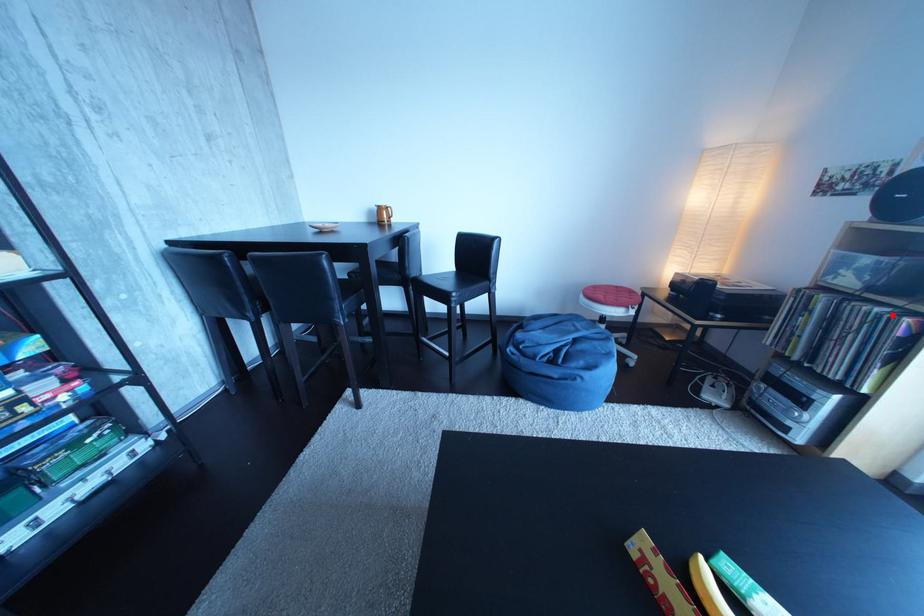
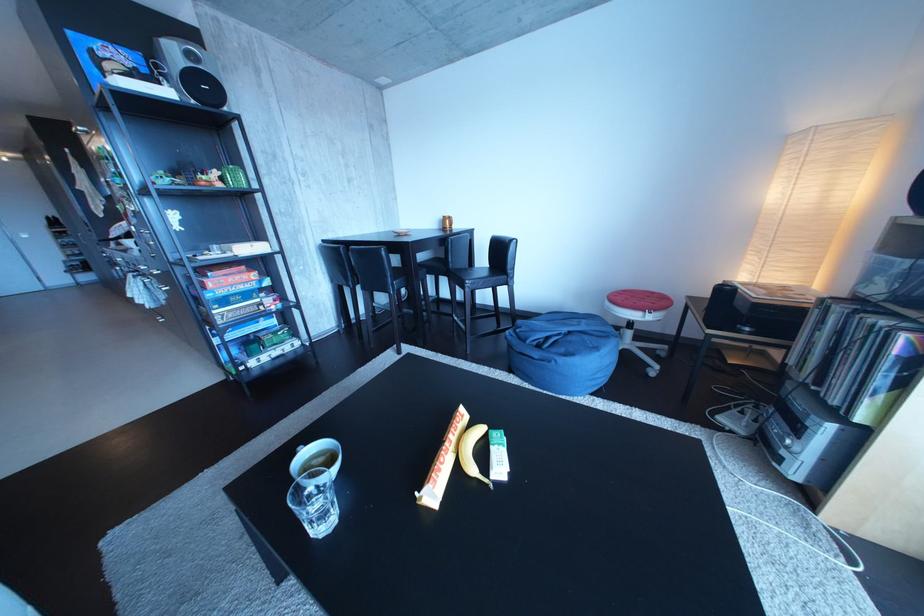
Find the pixel in the second image that matches the highlighted location in the first image.

(896, 328)